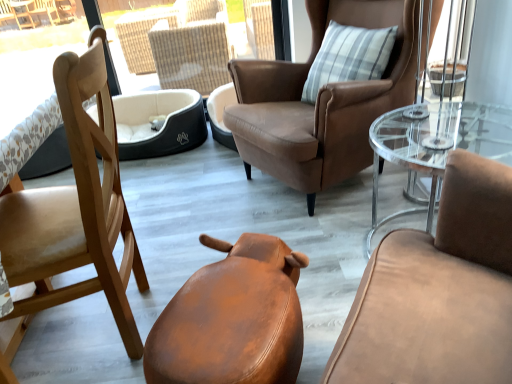
Question: From a real-world perspective, does clear glass coffee table at right sit lower than brown leather chair at upper center, which ranks as the 3th chair in left-to-right order?

Choices:
 (A) yes
 (B) no

Answer: (A)

Question: From the image's perspective, is clear glass coffee table at right on top of brown leather chair at upper center, acting as the first chair starting from the right?

Choices:
 (A) yes
 (B) no

Answer: (B)

Question: Can you confirm if clear glass coffee table at right is wider than brown leather chair at upper center, acting as the first chair starting from the right?

Choices:
 (A) no
 (B) yes

Answer: (A)

Question: Is clear glass coffee table at right facing away from brown leather chair at upper center, which ranks as the 3th chair in left-to-right order?

Choices:
 (A) yes
 (B) no

Answer: (B)

Question: Is clear glass coffee table at right taller than brown leather chair at upper center, acting as the first chair starting from the right?

Choices:
 (A) no
 (B) yes

Answer: (A)

Question: Is black fabric dog bed at center inside or outside of brown leather chair at upper center, acting as the first chair starting from the right?

Choices:
 (A) inside
 (B) outside

Answer: (B)

Question: In the image, is black fabric dog bed at center positioned in front of or behind brown leather chair at upper center, which ranks as the 3th chair in left-to-right order?

Choices:
 (A) front
 (B) behind

Answer: (B)

Question: Is point (142, 132) closer or farther from the camera than point (322, 8)?

Choices:
 (A) closer
 (B) farther

Answer: (B)

Question: In terms of height, does black fabric dog bed at center look taller or shorter compared to brown leather chair at upper center, acting as the first chair starting from the right?

Choices:
 (A) short
 (B) tall

Answer: (A)

Question: From the image's perspective, is clear glass coffee table at right located above or below light brown wood chair at left, which appears as the 1th chair when viewed from the left?

Choices:
 (A) below
 (B) above

Answer: (B)

Question: Visually, is clear glass coffee table at right positioned to the left or to the right of light brown wood chair at left, which appears as the 1th chair when viewed from the left?

Choices:
 (A) left
 (B) right

Answer: (B)

Question: Looking at the image, does clear glass coffee table at right seem bigger or smaller compared to light brown wood chair at left, which appears as the 1th chair when viewed from the left?

Choices:
 (A) small
 (B) big

Answer: (A)

Question: From a real-world perspective, is clear glass coffee table at right above or below light brown wood chair at left, which appears as the 1th chair when viewed from the left?

Choices:
 (A) below
 (B) above

Answer: (A)

Question: Considering their positions, is light brown wood chair at left, which is counted as the 3th chair, starting from the right, located in front of or behind leather-like brown stool at lower center, which appears as the 2th chair when viewed from the left?

Choices:
 (A) behind
 (B) front

Answer: (A)

Question: Is light brown wood chair at left, which is counted as the 3th chair, starting from the right, spatially inside leather-like brown stool at lower center, which appears as the 2th chair when viewed from the left, or outside of it?

Choices:
 (A) outside
 (B) inside

Answer: (A)